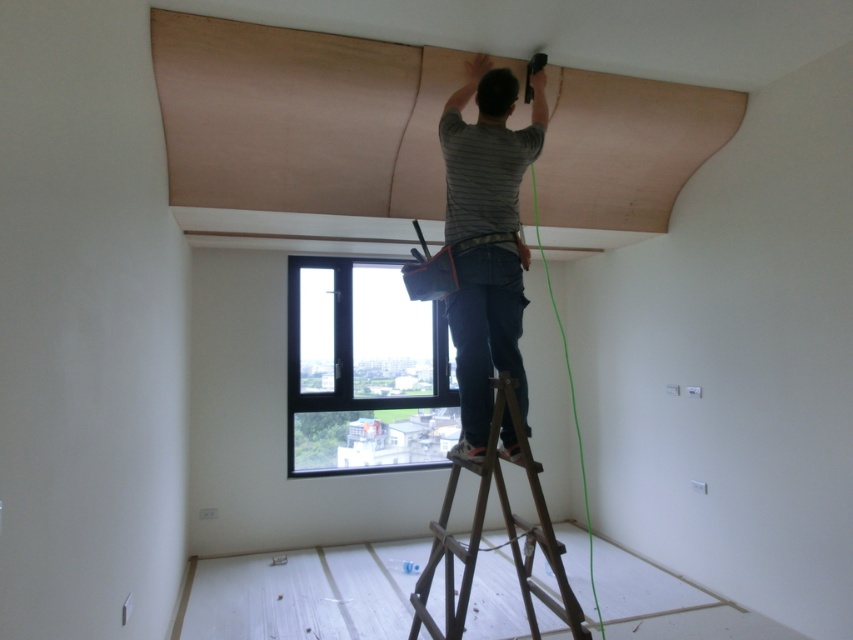
Question: Can you confirm if black plastic window at center is positioned above gray striped shirt at upper center?

Choices:
 (A) no
 (B) yes

Answer: (A)

Question: Does gray striped shirt at upper center have a greater width compared to brown wooden ladder at center?

Choices:
 (A) yes
 (B) no

Answer: (B)

Question: Which object appears farthest from the camera in this image?

Choices:
 (A) gray striped shirt at upper center
 (B) black plastic window at center
 (C) brown wooden ladder at center

Answer: (B)

Question: Among these points, which one is nearest to the camera?

Choices:
 (A) (469, 124)
 (B) (360, 330)

Answer: (A)

Question: Does gray striped shirt at upper center appear under brown wooden ladder at center?

Choices:
 (A) no
 (B) yes

Answer: (A)

Question: Considering the real-world distances, which object is closest to the gray striped shirt at upper center?

Choices:
 (A) brown wooden ladder at center
 (B) black plastic window at center

Answer: (A)